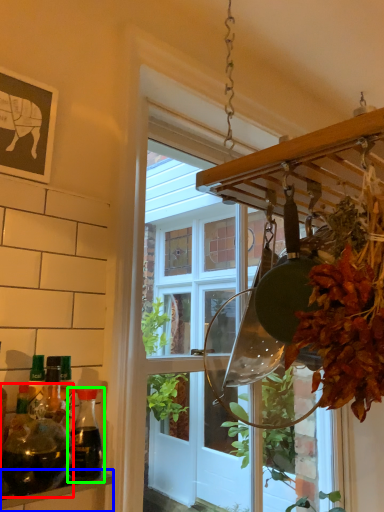
Question: Which object is the farthest from bottle (highlighted by a red box)? Choose among these: shelf (highlighted by a blue box) or bottle (highlighted by a green box).

Choices:
 (A) shelf
 (B) bottle

Answer: (A)